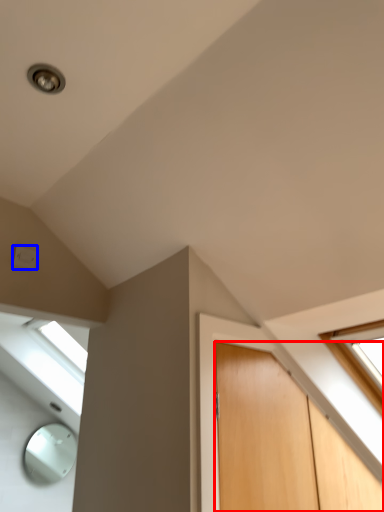
Question: Which of the following is the closest to the observer, door (highlighted by a red box) or electric outlet (highlighted by a blue box)?

Choices:
 (A) door
 (B) electric outlet

Answer: (A)